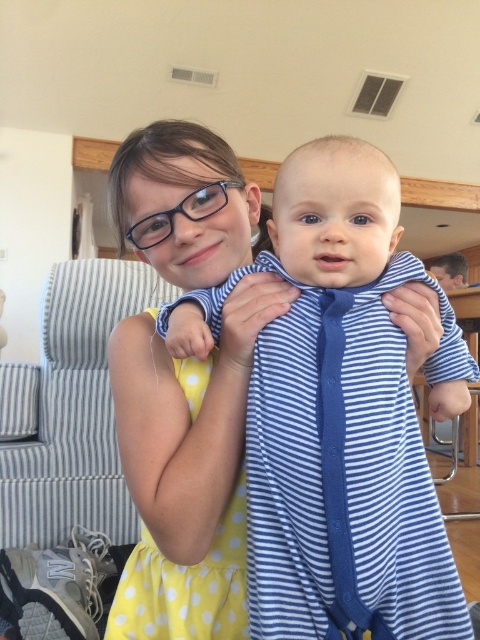
You are a photographer setting up a shoot in this living room. You need to place a small prop between the blue striped onesie at center and the yellow polka dot dress at center. Which side of the prop should face the larger clothing item?

The blue striped onesie at center is larger than the yellow polka dot dress at center, so the prop should be placed facing the blue striped onesie at center.

You are a photographer trying to capture a closeup of the baby in the blue striped onesie at center. Since the yellow polka dot dress at center is blocking the view, can you adjust your position to get a clear shot without moving any objects?

The blue striped onesie at center is located above the yellow polka dot dress at center, so you can lower your camera angle or move slightly downward to capture the baby without moving any objects.

You are a photographer trying to capture a photo of the blue striped onesie at center and the yellow polka dot dress at center. Which one should you focus on first if you want to capture the taller object?

The blue striped onesie at center is taller than the yellow polka dot dress at center, so you should focus on the blue striped onesie at center first to capture the taller object.